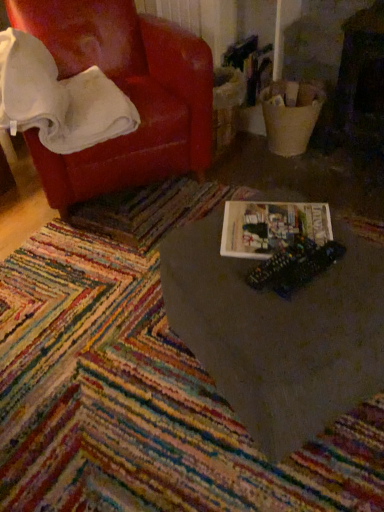
Locate an element on the screen. The width and height of the screenshot is (384, 512). hardcover book at center is located at coordinates (271, 227).

You are a GUI agent. You are given a task and a screenshot of the screen. Output one action in this format:
    pyautogui.click(x=<x>, y=<y>)
    Task: Click on the white glossy book at center
    The width and height of the screenshot is (384, 512).
    Given the screenshot: What is the action you would take?
    pyautogui.click(x=278, y=333)

Where is `white soft blanket at upper left`? This screenshot has width=384, height=512. white soft blanket at upper left is located at coordinates pos(58,98).

Is white soft blanket at upper left oriented away from metallic plastic toy at center?

No, white soft blanket at upper left's orientation is not away from metallic plastic toy at center.

Considering the positions of point (45, 70) and point (308, 277), is point (45, 70) closer or farther from the camera than point (308, 277)?

Point (45, 70).

Does white soft blanket at upper left have a smaller size compared to metallic plastic toy at center?

No, white soft blanket at upper left is not smaller than metallic plastic toy at center.

Could you tell me if hardcover book at center is turned towards metallic plastic toy at center?

Yes, hardcover book at center is turned towards metallic plastic toy at center.

Looking at this image, is hardcover book at center positioned beyond the bounds of metallic plastic toy at center?

Yes.

Is hardcover book at center not close to metallic plastic toy at center?

Actually, hardcover book at center and metallic plastic toy at center are a little close together.

Between hardcover book at center and metallic plastic toy at center, which one appears on the right side from the viewer's perspective?

Positioned to the right is metallic plastic toy at center.

Can you confirm if leather-like red armchair at upper left is shorter than white soft blanket at upper left?

Incorrect, the height of leather-like red armchair at upper left does not fall short of that of white soft blanket at upper left.

From the image's perspective, which is below, leather-like red armchair at upper left or white soft blanket at upper left?

From the image's view, white soft blanket at upper left is below.

Between leather-like red armchair at upper left and white soft blanket at upper left, which one is positioned behind?

leather-like red armchair at upper left is behind.

Find the location of `chair above the white soft blanket at upper left (from the image's perspective)`. chair above the white soft blanket at upper left (from the image's perspective) is located at coordinates (126, 94).

Considering the sizes of objects metallic plastic toy at center and leather-like red armchair at upper left in the image provided, who is bigger, metallic plastic toy at center or leather-like red armchair at upper left?

Bigger between the two is leather-like red armchair at upper left.

Does metallic plastic toy at center have a greater height compared to leather-like red armchair at upper left?

In fact, metallic plastic toy at center may be shorter than leather-like red armchair at upper left.

Choose the correct answer: Is metallic plastic toy at center inside leather-like red armchair at upper left or outside it?

metallic plastic toy at center exists outside the volume of leather-like red armchair at upper left.

Considering the relative positions of white glossy book at center and metallic plastic toy at center in the image provided, is white glossy book at center to the left or to the right of metallic plastic toy at center?

Based on their positions, white glossy book at center is located to the right of metallic plastic toy at center.

Locate an element on the screen. table lying below the metallic plastic toy at center (from the image's perspective) is located at coordinates (278, 333).

Based on the photo, what's the angular difference between white glossy book at center and metallic plastic toy at center's facing directions?

8.31 degrees separate the facing orientations of white glossy book at center and metallic plastic toy at center.

Which object is thinner, white glossy book at center or metallic plastic toy at center?

With smaller width is metallic plastic toy at center.

Between white soft blanket at upper left and leather-like red armchair at upper left, which one has less height?

white soft blanket at upper left.

Can you confirm if white soft blanket at upper left is smaller than leather-like red armchair at upper left?

Yes, white soft blanket at upper left is smaller than leather-like red armchair at upper left.

In the scene shown: From a real-world perspective, does white soft blanket at upper left stand above leather-like red armchair at upper left?

Indeed, from a real-world perspective, white soft blanket at upper left stands above leather-like red armchair at upper left.

Is white soft blanket at upper left in front of or behind leather-like red armchair at upper left in the image?

white soft blanket at upper left is positioned closer to the viewer than leather-like red armchair at upper left.

Does point (244, 206) come closer to viewer compared to point (285, 377)?

No, it is behind (285, 377).

Between hardcover book at center and white glossy book at center, which one has larger size?

With larger size is white glossy book at center.

Can you confirm if hardcover book at center is positioned to the right of white glossy book at center?

Incorrect, hardcover book at center is not on the right side of white glossy book at center.

Which of these two, hardcover book at center or white glossy book at center, is thinner?

Thinner between the two is hardcover book at center.

The image size is (384, 512). Find the location of `blanket located on the left of metallic plastic toy at center`. blanket located on the left of metallic plastic toy at center is located at coordinates (58, 98).

Where is `toy located below the hardcover book at center (from the image's perspective)`? The width and height of the screenshot is (384, 512). toy located below the hardcover book at center (from the image's perspective) is located at coordinates tap(295, 266).

Estimate the real-world distances between objects in this image. Which object is closer to leather-like red armchair at upper left, metallic plastic toy at center or white soft blanket at upper left?

white soft blanket at upper left.

Which object lies nearer to the anchor point multicolored woven mat at center, white soft blanket at upper left or metallic plastic toy at center?

metallic plastic toy at center is positioned closer to the anchor multicolored woven mat at center.

Consider the image. Which object lies nearer to the anchor point multicolored woven mat at center, white glossy book at center or white soft blanket at upper left?

white glossy book at center is positioned closer to the anchor multicolored woven mat at center.

Considering their positions, is white soft blanket at upper left positioned further to multicolored woven mat at center than leather-like red armchair at upper left?

The object further to multicolored woven mat at center is leather-like red armchair at upper left.

From the image, which object appears to be farther from leather-like red armchair at upper left, white glossy book at center or multicolored woven mat at center?

The object further to leather-like red armchair at upper left is white glossy book at center.

From the image, which object appears to be farther from white soft blanket at upper left, white glossy book at center or hardcover book at center?

The object further to white soft blanket at upper left is white glossy book at center.

Considering their positions, is leather-like red armchair at upper left positioned closer to multicolored woven mat at center than metallic plastic toy at center?

The object closer to multicolored woven mat at center is metallic plastic toy at center.

When comparing their distances from metallic plastic toy at center, does leather-like red armchair at upper left or multicolored woven mat at center seem further?

Among the two, leather-like red armchair at upper left is located further to metallic plastic toy at center.

Locate an element on the screen. The height and width of the screenshot is (512, 384). book between white soft blanket at upper left and white glossy book at center in the vertical direction is located at coordinates (x=271, y=227).

Identify the location of book between leather-like red armchair at upper left and metallic plastic toy at center vertically. (271, 227).

Find the location of a particular element. table that lies between white soft blanket at upper left and multicolored woven mat at center from top to bottom is located at coordinates (278, 333).

Locate an element on the screen. chair situated between white soft blanket at upper left and hardcover book at center from left to right is located at coordinates (126, 94).